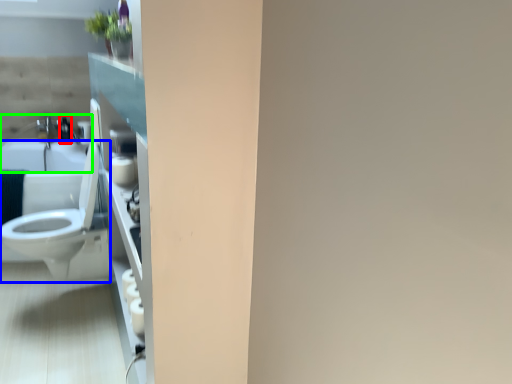
Question: Estimate the real-world distances between objects in this image. Which object is farther from toiletry (highlighted by a red box), toilet (highlighted by a blue box) or sink (highlighted by a green box)?

Choices:
 (A) toilet
 (B) sink

Answer: (A)